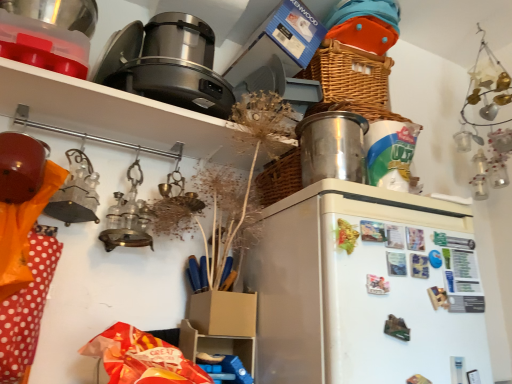
The height and width of the screenshot is (384, 512). Describe the element at coordinates (332, 146) in the screenshot. I see `shiny metallic container at upper right, the first appliance when ordered from right to left` at that location.

This screenshot has width=512, height=384. Identify the location of white matte refrigerator at center. (364, 287).

I want to click on matte black pot at upper left, so click(x=118, y=114).

Looking at their sizes, would you say shiny metallic container at upper right, the second appliance from the top, is wider or thinner than matte black pot at upper left?

Clearly, shiny metallic container at upper right, the second appliance from the top, has less width compared to matte black pot at upper left.

Could you tell me if shiny metallic container at upper right, the 1th appliance ordered from the bottom, is facing matte black pot at upper left?

No, shiny metallic container at upper right, the 1th appliance ordered from the bottom, does not turn towards matte black pot at upper left.

Between shiny metallic container at upper right, the second appliance from the top, and matte black pot at upper left, which one has smaller size?

shiny metallic container at upper right, the second appliance from the top, is smaller.

From a real-world perspective, is matte black pot at upper left under white matte refrigerator at center?

Incorrect, from a real-world perspective, matte black pot at upper left is higher than white matte refrigerator at center.

Between matte black pot at upper left and white matte refrigerator at center, which one has larger size?

white matte refrigerator at center is bigger.

From their relative heights in the image, would you say matte black pot at upper left is taller or shorter than white matte refrigerator at center?

Considering their sizes, matte black pot at upper left has less height than white matte refrigerator at center.

How many degrees apart are the facing directions of matte black pot at upper left and white matte refrigerator at center?

matte black pot at upper left and white matte refrigerator at center are facing 2.45 degrees away from each other.

Is white matte refrigerator at center outside of satin silver appliance at upper center, which ranks as the first appliance in left-to-right order?

Absolutely, white matte refrigerator at center is external to satin silver appliance at upper center, which ranks as the first appliance in left-to-right order.

Is point (284, 350) positioned behind point (183, 93)?

No, it is not.

Based on the photo, who is bigger, white matte refrigerator at center or satin silver appliance at upper center, which ranks as the first appliance in left-to-right order?

white matte refrigerator at center.

Visually, is shiny metallic container at upper right, the second appliance from the top, positioned to the left or to the right of satin silver appliance at upper center, which appears as the second appliance when viewed from the right?

In the image, shiny metallic container at upper right, the second appliance from the top, appears on the right side of satin silver appliance at upper center, which appears as the second appliance when viewed from the right.

Consider the image. Does shiny metallic container at upper right, which ranks as the 2th appliance in left-to-right order, lie in front of satin silver appliance at upper center, marked as the 1th appliance in a top-to-bottom arrangement?

That is True.

Choose the correct answer: Is shiny metallic container at upper right, the 1th appliance ordered from the bottom, inside satin silver appliance at upper center, which appears as the second appliance when viewed from the right, or outside it?

shiny metallic container at upper right, the 1th appliance ordered from the bottom, cannot be found inside satin silver appliance at upper center, which appears as the second appliance when viewed from the right.

Which of these two, shiny metallic container at upper right, the second appliance from the top, or satin silver appliance at upper center, which appears as the second appliance when viewed from the right, stands shorter?

With less height is satin silver appliance at upper center, which appears as the second appliance when viewed from the right.

From the image's perspective, would you say white matte refrigerator at center is shown under matte black pot at upper left?

Yes, from the image's perspective, white matte refrigerator at center is below matte black pot at upper left.

Measure the distance from white matte refrigerator at center to matte black pot at upper left.

white matte refrigerator at center is 50.30 centimeters from matte black pot at upper left.

Does white matte refrigerator at center have a lesser height compared to matte black pot at upper left?

In fact, white matte refrigerator at center may be taller than matte black pot at upper left.

Looking at the image, does white matte refrigerator at center seem bigger or smaller compared to matte black pot at upper left?

In the image, white matte refrigerator at center appears to be larger than matte black pot at upper left.

Is satin silver appliance at upper center, marked as the 1th appliance in a top-to-bottom arrangement, oriented away from white matte refrigerator at center?

No, white matte refrigerator at center is not at the back of satin silver appliance at upper center, marked as the 1th appliance in a top-to-bottom arrangement.

Can you confirm if satin silver appliance at upper center, positioned as the 2th appliance in bottom-to-top order, is positioned to the left of white matte refrigerator at center?

Correct, you'll find satin silver appliance at upper center, positioned as the 2th appliance in bottom-to-top order, to the left of white matte refrigerator at center.

Between satin silver appliance at upper center, which ranks as the first appliance in left-to-right order, and white matte refrigerator at center, which one has larger width?

white matte refrigerator at center.

From a real-world perspective, is satin silver appliance at upper center, which ranks as the first appliance in left-to-right order, below white matte refrigerator at center?

No, from a real-world perspective, satin silver appliance at upper center, which ranks as the first appliance in left-to-right order, is not beneath white matte refrigerator at center.

Who is bigger, shiny metallic container at upper right, the 1th appliance ordered from the bottom, or white matte refrigerator at center?

With larger size is white matte refrigerator at center.

Is shiny metallic container at upper right, the first appliance when ordered from right to left, located outside white matte refrigerator at center?

shiny metallic container at upper right, the first appliance when ordered from right to left, is positioned outside white matte refrigerator at center.

Which point is more forward, [343,140] or [301,222]?

Point [301,222]

Identify the location of shelf above the shiny metallic container at upper right, which ranks as the 2th appliance in left-to-right order (from the image's perspective). The width and height of the screenshot is (512, 384). (118, 114).

Locate an element on the screen. shelf behind the white matte refrigerator at center is located at coordinates (118, 114).

Considering their positions, is satin silver appliance at upper center, which ranks as the first appliance in left-to-right order, positioned closer to shiny metallic container at upper right, the first appliance when ordered from right to left, than white matte refrigerator at center?

white matte refrigerator at center.

Which object lies further to the anchor point matte black pot at upper left, satin silver appliance at upper center, positioned as the 2th appliance in bottom-to-top order, or white matte refrigerator at center?

Among the two, white matte refrigerator at center is located further to matte black pot at upper left.

Based on their spatial positions, is shiny metallic container at upper right, the second appliance from the top, or white matte refrigerator at center further from matte black pot at upper left?

white matte refrigerator at center lies further to matte black pot at upper left than the other object.

When comparing their distances from matte black pot at upper left, does white matte refrigerator at center or shiny metallic container at upper right, the first appliance when ordered from right to left, seem further?

white matte refrigerator at center is positioned further to the anchor matte black pot at upper left.

Which object lies nearer to the anchor point white matte refrigerator at center, matte black pot at upper left or satin silver appliance at upper center, which ranks as the first appliance in left-to-right order?

Among the two, matte black pot at upper left is located nearer to white matte refrigerator at center.

In the scene shown: Based on their spatial positions, is satin silver appliance at upper center, positioned as the 2th appliance in bottom-to-top order, or shiny metallic container at upper right, the second appliance from the top, further from white matte refrigerator at center?

satin silver appliance at upper center, positioned as the 2th appliance in bottom-to-top order, is further to white matte refrigerator at center.

From the image, which object appears to be farther from shiny metallic container at upper right, the 1th appliance ordered from the bottom, matte black pot at upper left or satin silver appliance at upper center, positioned as the 2th appliance in bottom-to-top order?

satin silver appliance at upper center, positioned as the 2th appliance in bottom-to-top order, is further to shiny metallic container at upper right, the 1th appliance ordered from the bottom.

When comparing their distances from matte black pot at upper left, does shiny metallic container at upper right, which ranks as the 2th appliance in left-to-right order, or satin silver appliance at upper center, positioned as the 2th appliance in bottom-to-top order, seem further?

shiny metallic container at upper right, which ranks as the 2th appliance in left-to-right order, is positioned further to the anchor matte black pot at upper left.

This screenshot has width=512, height=384. What are the coordinates of `appliance that lies between satin silver appliance at upper center, positioned as the 2th appliance in bottom-to-top order, and white matte refrigerator at center from top to bottom` in the screenshot? It's located at (332, 146).

Find the location of a particular element. appliance between matte black pot at upper left and shiny metallic container at upper right, the second appliance from the top, from left to right is located at coordinates (168, 64).